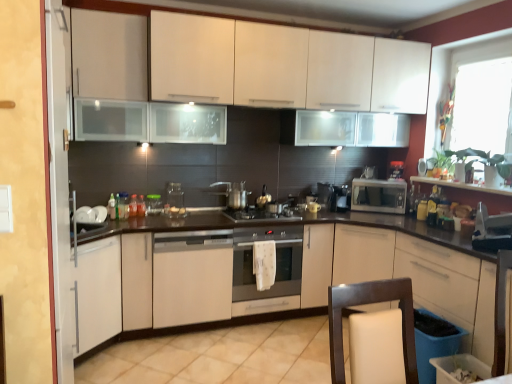
Question: Is transparent glass jar at center, which is counted as the eighth appliance, starting from the right, in front of or behind translucent glass jar at center, which is counted as the 1th bottle, starting from the left, in the image?

Choices:
 (A) front
 (B) behind

Answer: (B)

Question: Considering the relative positions of transparent glass jar at center, which is counted as the eighth appliance, starting from the right, and translucent glass jar at center, placed as the 2th bottle when sorted from right to left, in the image provided, is transparent glass jar at center, which is counted as the eighth appliance, starting from the right, to the left or to the right of translucent glass jar at center, placed as the 2th bottle when sorted from right to left,?

Choices:
 (A) left
 (B) right

Answer: (B)

Question: Which of these objects is positioned closest to the white glossy microwave at upper right, the sixth appliance positioned from the left?

Choices:
 (A) transparent glass jar at center, which is counted as the eighth appliance, starting from the right
 (B) satin silver kettle at center, the seventh appliance from the right
 (C) white matte dishwasher at center, the 2th home appliance viewed from the right
 (D) satin silver oven at center, which is counted as the first home appliance, starting from the right
 (E) metallic silver toaster at right, the first appliance when ordered from right to left

Answer: (B)

Question: Which of these objects is positioned closest to the satin silver coffee maker at center, arranged as the 5th appliance when viewed from the left?

Choices:
 (A) metallic silver toaster at right, the first appliance when ordered from right to left
 (B) satin silver kettle at center, the 3th appliance in the left-to-right sequence
 (C) translucent glass bottle at center, acting as the second bottle starting from the left
 (D) translucent glass jar at center, which is counted as the 1th bottle, starting from the left
 (E) satin silver oven at center, which is counted as the first home appliance, starting from the right

Answer: (B)